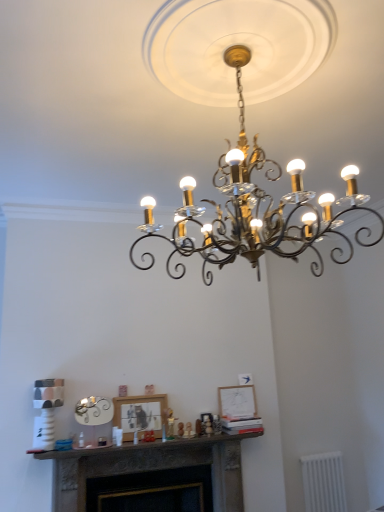
Question: From a real-world perspective, is black wrought iron chandelier at center on matte black picture frame at center, positioned as the second picture frame in right-to-left order?

Choices:
 (A) yes
 (B) no

Answer: (A)

Question: Considering the relative sizes of black wrought iron chandelier at center and matte black picture frame at center, marked as the 1th picture frame in a front-to-back arrangement, in the image provided, is black wrought iron chandelier at center thinner than matte black picture frame at center, marked as the 1th picture frame in a front-to-back arrangement,?

Choices:
 (A) yes
 (B) no

Answer: (B)

Question: Does black wrought iron chandelier at center contain matte black picture frame at center, the 1th picture frame positioned from the left?

Choices:
 (A) no
 (B) yes

Answer: (A)

Question: Can you confirm if black wrought iron chandelier at center is smaller than matte black picture frame at center, positioned as the second picture frame in right-to-left order?

Choices:
 (A) yes
 (B) no

Answer: (B)

Question: Is black wrought iron chandelier at center taller than matte black picture frame at center, positioned as the second picture frame in right-to-left order?

Choices:
 (A) no
 (B) yes

Answer: (B)

Question: Is black wrought iron chandelier at center closer to the viewer compared to matte black picture frame at center, the 1th picture frame positioned from the left?

Choices:
 (A) no
 (B) yes

Answer: (B)

Question: Considering the relative positions of matte white picture frame at center, placed as the 1th picture frame when sorted from back to front, and matte black picture frame at center, positioned as the second picture frame in back-to-front order, in the image provided, is matte white picture frame at center, placed as the 1th picture frame when sorted from back to front, to the right of matte black picture frame at center, positioned as the second picture frame in back-to-front order, from the viewer's perspective?

Choices:
 (A) no
 (B) yes

Answer: (B)

Question: Are matte white picture frame at center, which appears as the 1th picture frame when viewed from the right, and matte black picture frame at center, positioned as the second picture frame in back-to-front order, beside each other?

Choices:
 (A) yes
 (B) no

Answer: (B)

Question: Considering the relative positions of matte white picture frame at center, which appears as the 1th picture frame when viewed from the right, and matte black picture frame at center, marked as the 1th picture frame in a front-to-back arrangement, in the image provided, is matte white picture frame at center, which appears as the 1th picture frame when viewed from the right, to the left of matte black picture frame at center, marked as the 1th picture frame in a front-to-back arrangement, from the viewer's perspective?

Choices:
 (A) yes
 (B) no

Answer: (B)

Question: Can you confirm if matte white picture frame at center, placed as the 1th picture frame when sorted from back to front, is wider than matte black picture frame at center, positioned as the second picture frame in right-to-left order?

Choices:
 (A) yes
 (B) no

Answer: (B)

Question: Is matte white picture frame at center, placed as the 1th picture frame when sorted from back to front, oriented away from matte black picture frame at center, marked as the 1th picture frame in a front-to-back arrangement?

Choices:
 (A) yes
 (B) no

Answer: (B)

Question: From a real-world perspective, is matte white picture frame at center, placed as the 1th picture frame when sorted from back to front, physically above matte black picture frame at center, positioned as the second picture frame in back-to-front order?

Choices:
 (A) no
 (B) yes

Answer: (B)

Question: Considering the relative sizes of white plastic radiator at lower right and matte white picture frame at center, placed as the 1th picture frame when sorted from back to front, in the image provided, is white plastic radiator at lower right smaller than matte white picture frame at center, placed as the 1th picture frame when sorted from back to front,?

Choices:
 (A) no
 (B) yes

Answer: (A)